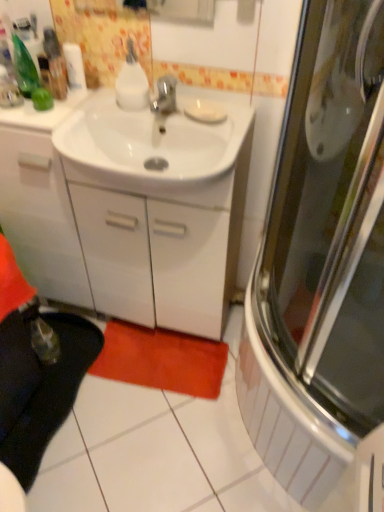
What is the approximate height of translucent plastic bottle at upper left, which is counted as the first bottle, starting from the left?

translucent plastic bottle at upper left, which is counted as the first bottle, starting from the left, is 5.02 inches tall.

What are the coordinates of `white matte toilet paper at upper left` in the screenshot? It's located at (74, 65).

At what (x,y) coordinates should I click in order to perform the action: click on white glossy cabinet at center. Please return your answer as a coordinate pair (x, y). The image size is (384, 512). Looking at the image, I should click on (130, 212).

What do you see at coordinates (205, 111) in the screenshot? This screenshot has height=512, width=384. I see `white matte soap at center` at bounding box center [205, 111].

You are a GUI agent. You are given a task and a screenshot of the screen. Output one action in this format:
    pyautogui.click(x=<x>, y=<y>)
    Task: Click on the white glossy sink at center
    This screenshot has width=384, height=512.
    Given the screenshot: What is the action you would take?
    pyautogui.click(x=152, y=143)

Does orange plush bath mat at lower center appear on the left side of black fabric carpet at lower left?

No.

Considering the points (135, 336) and (7, 358), which point is behind, point (135, 336) or point (7, 358)?

Point (135, 336)

Which object is further away from the camera taking this photo, orange plush bath mat at lower center or black fabric carpet at lower left?

orange plush bath mat at lower center is more distant.

Considering the sizes of objects orange plush bath mat at lower center and black fabric carpet at lower left in the image provided, who is bigger, orange plush bath mat at lower center or black fabric carpet at lower left?

With larger size is black fabric carpet at lower left.

From a real-world perspective, is black fabric carpet at lower left below translucent plastic bottles at upper left?

Yes, from a real-world perspective, black fabric carpet at lower left is below translucent plastic bottles at upper left.

Who is smaller, black fabric carpet at lower left or translucent plastic bottles at upper left?

translucent plastic bottles at upper left is smaller.

From the image's perspective, is black fabric carpet at lower left located beneath translucent plastic bottles at upper left?

Yes, from the image's perspective, black fabric carpet at lower left is below translucent plastic bottles at upper left.

Considering the relative sizes of white glossy bottle at upper center, the first bottle positioned from the right, and translucent plastic bottles at upper left in the image provided, is white glossy bottle at upper center, the first bottle positioned from the right, thinner than translucent plastic bottles at upper left?

Yes.

Does white glossy bottle at upper center, the first bottle positioned from the right, have a greater height compared to translucent plastic bottles at upper left?

No, white glossy bottle at upper center, the first bottle positioned from the right, is not taller than translucent plastic bottles at upper left.

Which of these two, white glossy bottle at upper center, the first bottle positioned from the right, or translucent plastic bottles at upper left, is bigger?

translucent plastic bottles at upper left.

From a real-world perspective, is translucent plastic bottle at upper left, which is counted as the first bottle, starting from the left, located higher than black fabric carpet at lower left?

Yes.

Does translucent plastic bottle at upper left, positioned as the second bottle in right-to-left order, have a larger size compared to black fabric carpet at lower left?

No.

Based on the photo, how many degrees apart are the facing directions of translucent plastic bottle at upper left, positioned as the second bottle in right-to-left order, and black fabric carpet at lower left?

92.4 degrees.

Could you tell me if translucent plastic bottle at upper left, positioned as the second bottle in right-to-left order, is turned towards black fabric carpet at lower left?

No, translucent plastic bottle at upper left, positioned as the second bottle in right-to-left order, does not turn towards black fabric carpet at lower left.

How much distance is there between white glossy cabinet at center and white glossy bottle at upper center, the first bottle positioned from the right?

white glossy cabinet at center is 16.13 inches from white glossy bottle at upper center, the first bottle positioned from the right.

From the image's perspective, relative to white glossy bottle at upper center, the first bottle positioned from the right, is white glossy cabinet at center above or below?

Clearly, from the image's perspective, white glossy cabinet at center is below white glossy bottle at upper center, the first bottle positioned from the right.

Which is behind, point (158, 131) or point (130, 40)?

The point (158, 131) is farther.

From a real-world perspective, is white glossy cabinet at center physically located above or below white glossy bottle at upper center, which ranks as the second bottle in left-to-right order?

white glossy cabinet at center is below white glossy bottle at upper center, which ranks as the second bottle in left-to-right order.

Is white glossy bottle at upper center, which ranks as the second bottle in left-to-right order, oriented towards white glossy cabinet at center?

No, white glossy bottle at upper center, which ranks as the second bottle in left-to-right order, is not turned towards white glossy cabinet at center.

Identify the location of bathroom cabinet in front of the white glossy bottle at upper center, which ranks as the second bottle in left-to-right order. (130, 212).

Between white glossy bottle at upper center, the first bottle positioned from the right, and white glossy cabinet at center, which one has less height?

Standing shorter between the two is white glossy bottle at upper center, the first bottle positioned from the right.

From a real-world perspective, is white glossy bottle at upper center, the first bottle positioned from the right, physically located above or below black fabric carpet at lower left?

white glossy bottle at upper center, the first bottle positioned from the right, is situated higher than black fabric carpet at lower left in the real world.

Which of these two, white glossy bottle at upper center, which ranks as the second bottle in left-to-right order, or black fabric carpet at lower left, stands taller?

white glossy bottle at upper center, which ranks as the second bottle in left-to-right order.

Is white glossy bottle at upper center, the first bottle positioned from the right, not within black fabric carpet at lower left?

Absolutely, white glossy bottle at upper center, the first bottle positioned from the right, is external to black fabric carpet at lower left.

At what (x,y) coordinates should I click in order to perform the action: click on bath mat located above the black fabric carpet at lower left (from the image's perspective). Please return your answer as a coordinate pair (x, y). The width and height of the screenshot is (384, 512). Looking at the image, I should click on (161, 360).

Where is `toiletries on the right of black fabric carpet at lower left`? toiletries on the right of black fabric carpet at lower left is located at coordinates (28, 11).

Estimate the real-world distances between objects in this image. Which object is closer to translucent plastic bottles at upper left, translucent plastic bottle at upper left, positioned as the second bottle in right-to-left order, or white glossy bottle at upper center, which ranks as the second bottle in left-to-right order?

Among the two, translucent plastic bottle at upper left, positioned as the second bottle in right-to-left order, is located nearer to translucent plastic bottles at upper left.

When comparing their distances from black fabric carpet at lower left, does white matte soap at center or translucent plastic bottle at upper left, which is counted as the first bottle, starting from the left, seem closer?

translucent plastic bottle at upper left, which is counted as the first bottle, starting from the left, lies closer to black fabric carpet at lower left than the other object.

From the image, which object appears to be nearer to translucent plastic bottles at upper left, white glossy sink at center or white matte soap at center?

The object closer to translucent plastic bottles at upper left is white glossy sink at center.

Considering their positions, is white glossy sink at center positioned closer to translucent plastic bottles at upper left than white matte toilet paper at upper left?

white matte toilet paper at upper left is closer to translucent plastic bottles at upper left.

Considering their positions, is white glossy bottle at upper center, which ranks as the second bottle in left-to-right order, positioned further to white matte toilet paper at upper left than white glossy cabinet at center?

Based on the image, white glossy cabinet at center appears to be further to white matte toilet paper at upper left.

Looking at this image, considering their positions, is white matte soap at center positioned further to white matte toilet paper at upper left than black fabric carpet at lower left?

black fabric carpet at lower left.

From the image, which object appears to be farther from white glossy sink at center, orange plush bath mat at lower center or white matte toilet paper at upper left?

The object further to white glossy sink at center is orange plush bath mat at lower center.

Based on their spatial positions, is orange plush bath mat at lower center or white glossy bottle at upper center, the first bottle positioned from the right, closer to translucent plastic bottle at upper left, which is counted as the first bottle, starting from the left?

white glossy bottle at upper center, the first bottle positioned from the right, lies closer to translucent plastic bottle at upper left, which is counted as the first bottle, starting from the left, than the other object.

The image size is (384, 512). In order to click on soap between white glossy bottle at upper center, which ranks as the second bottle in left-to-right order, and orange plush bath mat at lower center, in the vertical direction in this screenshot , I will do `click(205, 111)`.

The width and height of the screenshot is (384, 512). Find the location of `bathroom cabinet between translucent plastic bottle at upper left, positioned as the second bottle in right-to-left order, and orange plush bath mat at lower center from top to bottom`. bathroom cabinet between translucent plastic bottle at upper left, positioned as the second bottle in right-to-left order, and orange plush bath mat at lower center from top to bottom is located at coordinates (130, 212).

You are a GUI agent. You are given a task and a screenshot of the screen. Output one action in this format:
    pyautogui.click(x=<x>, y=<y>)
    Task: Click on the bathroom cabinet between white matte soap at center and orange plush bath mat at lower center vertically
    The width and height of the screenshot is (384, 512).
    Given the screenshot: What is the action you would take?
    pyautogui.click(x=130, y=212)

The height and width of the screenshot is (512, 384). Find the location of `sink between translucent plastic bottle at upper left, which is counted as the first bottle, starting from the left, and orange plush bath mat at lower center, in the vertical direction`. sink between translucent plastic bottle at upper left, which is counted as the first bottle, starting from the left, and orange plush bath mat at lower center, in the vertical direction is located at coordinates (152, 143).